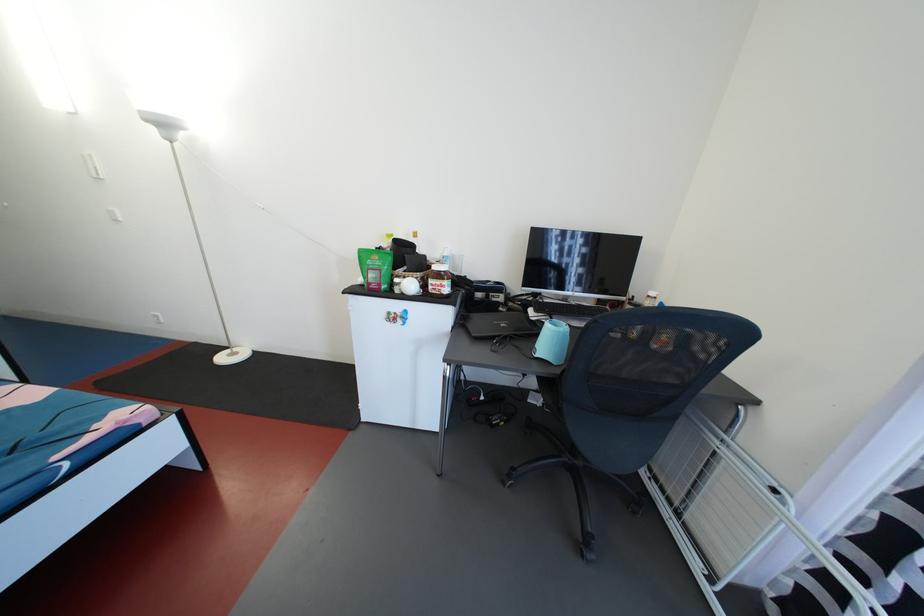
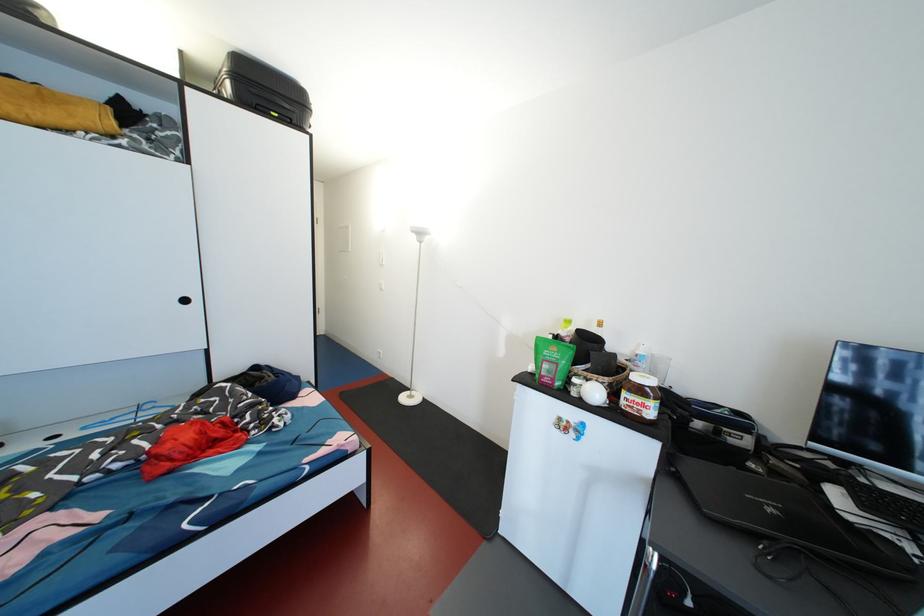
Locate, in the second image, the point that corresponds to point 467,328 in the first image.

(675, 474)